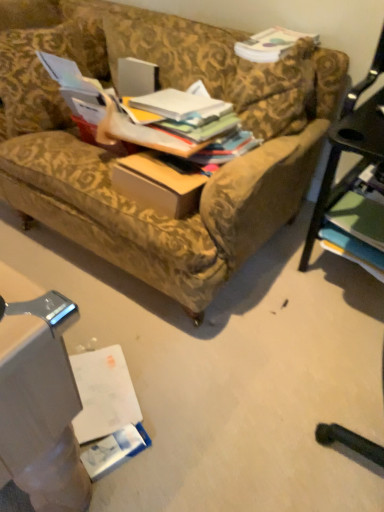
Question: Is green matte book at lower right, which appears as the fifth book when viewed from the top, positioned before multicolored paper stack at center, the fourth book when ordered from top to bottom?

Choices:
 (A) yes
 (B) no

Answer: (B)

Question: Is there a large distance between green matte book at lower right, the 1th book when ordered from bottom to top, and multicolored paper stack at center, the fourth book when ordered from top to bottom?

Choices:
 (A) no
 (B) yes

Answer: (A)

Question: Is green matte book at lower right, the 1th book when ordered from bottom to top, taller than multicolored paper stack at center, positioned as the 2th book in bottom-to-top order?

Choices:
 (A) no
 (B) yes

Answer: (B)

Question: Is green matte book at lower right, the 1th book when ordered from bottom to top, shorter than multicolored paper stack at center, the fourth book when ordered from top to bottom?

Choices:
 (A) yes
 (B) no

Answer: (B)

Question: Is green matte book at lower right, which appears as the fifth book when viewed from the top, bigger than multicolored paper stack at center, positioned as the 2th book in bottom-to-top order?

Choices:
 (A) no
 (B) yes

Answer: (B)

Question: Is green matte book at lower right, the 1th book when ordered from bottom to top, not inside multicolored paper stack at center, positioned as the 2th book in bottom-to-top order?

Choices:
 (A) no
 (B) yes

Answer: (B)

Question: Is multicolored paper stack at center, positioned as the 2th book in bottom-to-top order, directly adjacent to matte white book at upper center, the 5th book from the bottom?

Choices:
 (A) no
 (B) yes

Answer: (A)

Question: From a real-world perspective, is multicolored paper stack at center, positioned as the 2th book in bottom-to-top order, over matte white book at upper center, the 5th book from the bottom?

Choices:
 (A) yes
 (B) no

Answer: (B)

Question: Does multicolored paper stack at center, positioned as the 2th book in bottom-to-top order, come in front of matte white book at upper center, the 5th book from the bottom?

Choices:
 (A) yes
 (B) no

Answer: (A)

Question: From the image's perspective, would you say multicolored paper stack at center, the fourth book when ordered from top to bottom, is shown under matte white book at upper center, placed as the first book when sorted from top to bottom?

Choices:
 (A) yes
 (B) no

Answer: (A)

Question: Considering the relative positions of multicolored paper stack at center, the fourth book when ordered from top to bottom, and matte white book at upper center, placed as the first book when sorted from top to bottom, in the image provided, is multicolored paper stack at center, the fourth book when ordered from top to bottom, to the left of matte white book at upper center, placed as the first book when sorted from top to bottom, from the viewer's perspective?

Choices:
 (A) yes
 (B) no

Answer: (A)

Question: Would you consider multicolored paper stack at center, the fourth book when ordered from top to bottom, to be distant from matte white book at upper center, placed as the first book when sorted from top to bottom?

Choices:
 (A) no
 (B) yes

Answer: (A)

Question: From the image's perspective, would you say multicolored paper stack at center, positioned as the 2th book in bottom-to-top order, is positioned over green matte book at lower right, the 1th book when ordered from bottom to top?

Choices:
 (A) no
 (B) yes

Answer: (B)